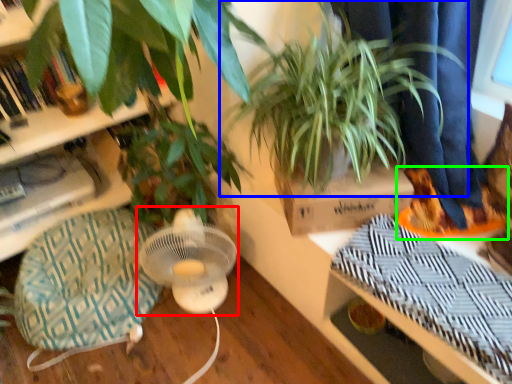
Question: Considering the real-world distances, which object is closest to mechanical fan (highlighted by a red box)? houseplant (highlighted by a blue box) or shoe (highlighted by a green box).

Choices:
 (A) houseplant
 (B) shoe

Answer: (A)